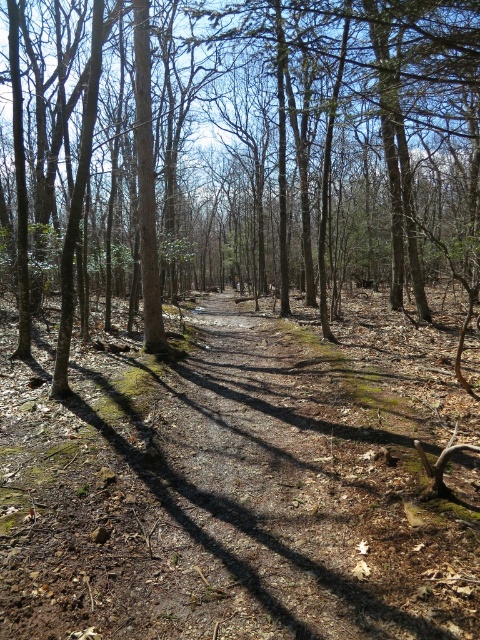
Question: Can you confirm if brown dirt track at center is positioned above brown bark tree at center?

Choices:
 (A) no
 (B) yes

Answer: (A)

Question: In this image, where is brown dirt track at center located relative to brown bark tree at center?

Choices:
 (A) right
 (B) left

Answer: (B)

Question: Which point appears farthest from the camera in this image?

Choices:
 (A) (215, 164)
 (B) (396, 435)

Answer: (A)

Question: Does brown dirt track at center come behind brown bark tree at center?

Choices:
 (A) no
 (B) yes

Answer: (A)

Question: Which point is closer to the camera taking this photo?

Choices:
 (A) (74, 476)
 (B) (157, 140)

Answer: (A)